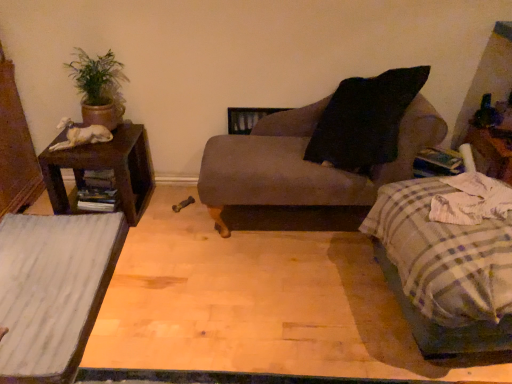
Question: Can you confirm if matte gray chaise at center is positioned to the right of brown wood nightstand at left?

Choices:
 (A) yes
 (B) no

Answer: (A)

Question: Can you confirm if matte gray chaise at center is shorter than brown wood nightstand at left?

Choices:
 (A) yes
 (B) no

Answer: (B)

Question: Is matte gray chaise at center not within brown wood nightstand at left?

Choices:
 (A) no
 (B) yes

Answer: (B)

Question: Is matte gray chaise at center in front of brown wood nightstand at left?

Choices:
 (A) yes
 (B) no

Answer: (A)

Question: Is matte gray chaise at center positioned far away from brown wood nightstand at left?

Choices:
 (A) yes
 (B) no

Answer: (B)

Question: Looking at their shapes, would you say green matte plant at upper left is wider or thinner than matte gray chaise at center?

Choices:
 (A) wide
 (B) thin

Answer: (B)

Question: Is point (83, 124) closer or farther from the camera than point (326, 107)?

Choices:
 (A) closer
 (B) farther

Answer: (A)

Question: In terms of size, does green matte plant at upper left appear bigger or smaller than matte gray chaise at center?

Choices:
 (A) big
 (B) small

Answer: (B)

Question: From a real-world perspective, is green matte plant at upper left above or below matte gray chaise at center?

Choices:
 (A) below
 (B) above

Answer: (B)

Question: From the image's perspective, is green matte plant at upper left located above or below plaid fabric bed at lower right?

Choices:
 (A) above
 (B) below

Answer: (A)

Question: Is green matte plant at upper left in front of or behind plaid fabric bed at lower right in the image?

Choices:
 (A) behind
 (B) front

Answer: (A)

Question: Is green matte plant at upper left taller or shorter than plaid fabric bed at lower right?

Choices:
 (A) short
 (B) tall

Answer: (A)

Question: Considering the positions of green matte plant at upper left and plaid fabric bed at lower right in the image, is green matte plant at upper left wider or thinner than plaid fabric bed at lower right?

Choices:
 (A) thin
 (B) wide

Answer: (A)

Question: Is point (115, 241) closer or farther from the camera than point (80, 104)?

Choices:
 (A) closer
 (B) farther

Answer: (A)

Question: In terms of width, does white wood table at lower left look wider or thinner when compared to green matte plant at upper left?

Choices:
 (A) wide
 (B) thin

Answer: (A)